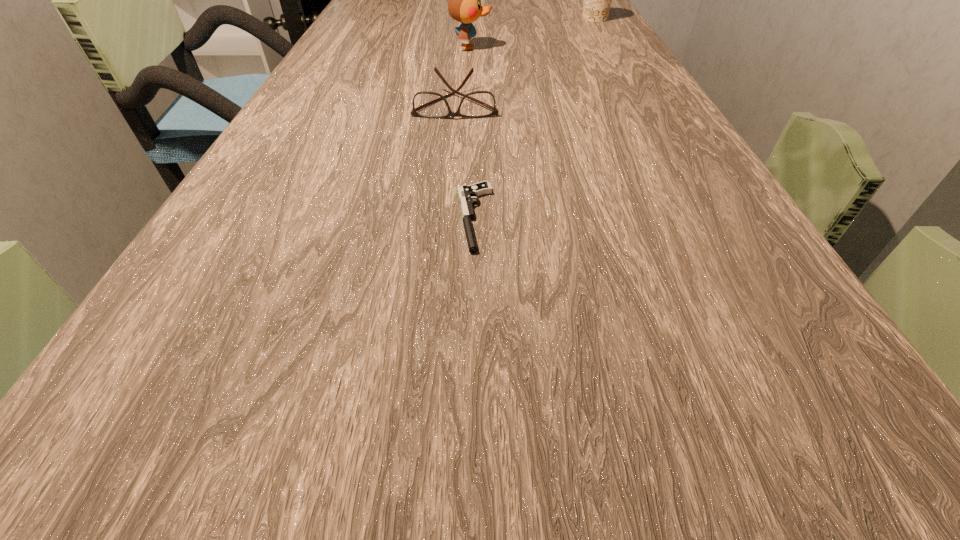
Identify the location of duck. This screenshot has width=960, height=540. (464, 5).

You are a GUI agent. You are given a task and a screenshot of the screen. Output one action in this format:
    pyautogui.click(x=<x>, y=<y>)
    Task: Click on the tallest object
    The height and width of the screenshot is (540, 960).
    Given the screenshot: What is the action you would take?
    pyautogui.click(x=464, y=5)

I want to click on the third shortest object, so click(597, 0).

Where is `the farthest object`? the farthest object is located at coordinates (597, 0).

This screenshot has width=960, height=540. Identify the location of spectacles. (426, 104).

Image resolution: width=960 pixels, height=540 pixels. In order to click on the third farthest object in this screenshot , I will do `click(426, 104)`.

Locate an element on the screen. The image size is (960, 540). the shortest object is located at coordinates (466, 193).

Identify the location of pistol. (466, 193).

The height and width of the screenshot is (540, 960). Find the location of `free space located 0.090m on the front-facing side of the duck`. free space located 0.090m on the front-facing side of the duck is located at coordinates (527, 47).

You are a GUI agent. You are given a task and a screenshot of the screen. Output one action in this format:
    pyautogui.click(x=<x>, y=<y>)
    Task: Click on the blank space located on the left of the farthest object
    The width and height of the screenshot is (960, 540).
    Given the screenshot: What is the action you would take?
    pyautogui.click(x=554, y=18)